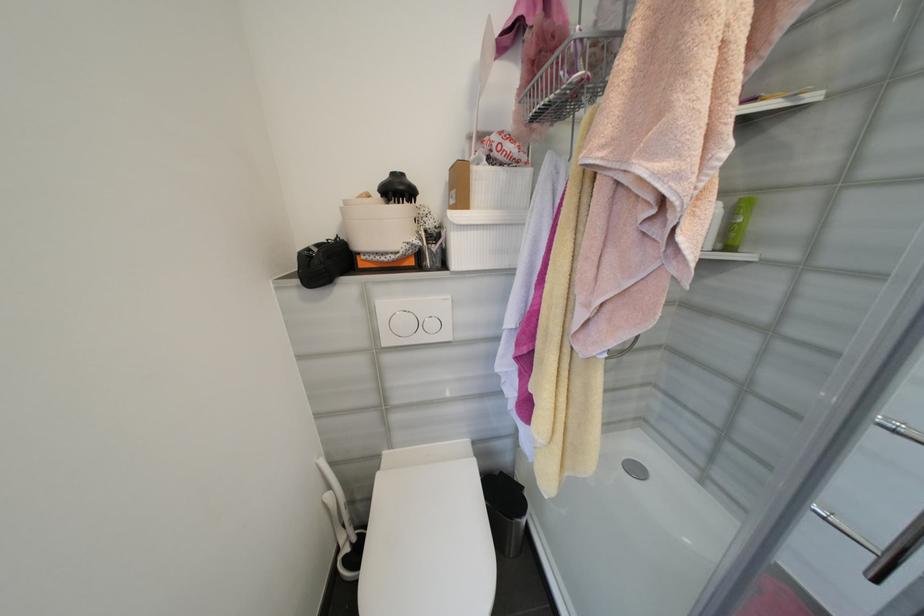
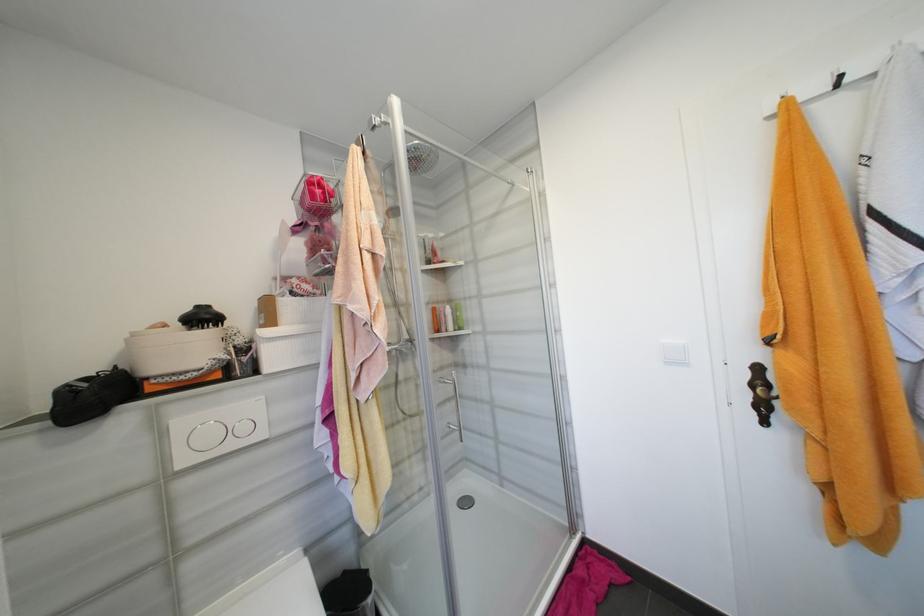
Find the pixel in the second image that matches pixel 405 191 in the first image.

(210, 318)